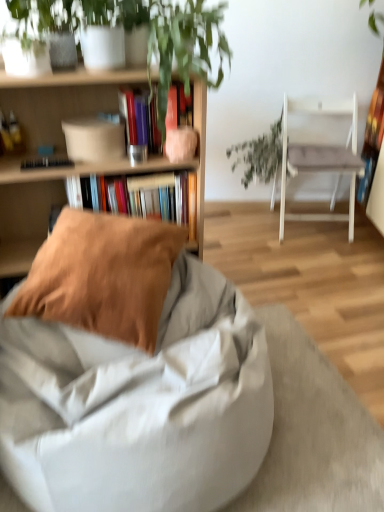
Question: Does hardcover book at center, positioned as the 2th book in bottom-to-top order, come behind light gray fabric bean bag at center, the first chair when ordered from front to back?

Choices:
 (A) no
 (B) yes

Answer: (B)

Question: Considering the relative sizes of hardcover book at center, positioned as the 2th book in bottom-to-top order, and light gray fabric bean bag at center, marked as the 1th chair in a left-to-right arrangement, in the image provided, is hardcover book at center, positioned as the 2th book in bottom-to-top order, taller than light gray fabric bean bag at center, marked as the 1th chair in a left-to-right arrangement,?

Choices:
 (A) yes
 (B) no

Answer: (B)

Question: Considering the relative sizes of hardcover book at center, which is counted as the 1th book, starting from the top, and light gray fabric bean bag at center, which appears as the second chair when viewed from the right, in the image provided, is hardcover book at center, which is counted as the 1th book, starting from the top, thinner than light gray fabric bean bag at center, which appears as the second chair when viewed from the right,?

Choices:
 (A) yes
 (B) no

Answer: (A)

Question: Does hardcover book at center, positioned as the 2th book in bottom-to-top order, have a larger size compared to light gray fabric bean bag at center, the 1th chair positioned from the bottom?

Choices:
 (A) yes
 (B) no

Answer: (B)

Question: Is hardcover book at center, positioned as the 2th book in bottom-to-top order, far from light gray fabric bean bag at center, the second chair positioned from the top?

Choices:
 (A) no
 (B) yes

Answer: (A)

Question: Does hardcover book at center, positioned as the 2th book in bottom-to-top order, turn towards light gray fabric bean bag at center, positioned as the 2th chair in back-to-front order?

Choices:
 (A) yes
 (B) no

Answer: (B)

Question: Is white fabric chair at right, acting as the second chair starting from the bottom, completely or partially outside of hardcover book at center, which is counted as the 1th book, starting from the top?

Choices:
 (A) yes
 (B) no

Answer: (A)

Question: Is white fabric chair at right, the second chair from the front, aimed at hardcover book at center, positioned as the 2th book in bottom-to-top order?

Choices:
 (A) no
 (B) yes

Answer: (A)

Question: Would you say hardcover book at center, which is counted as the 1th book, starting from the top, is part of white fabric chair at right, the second chair from the front,'s contents?

Choices:
 (A) yes
 (B) no

Answer: (B)

Question: Is white fabric chair at right, acting as the first chair starting from the right, oriented away from hardcover book at center, which is counted as the 1th book, starting from the top?

Choices:
 (A) no
 (B) yes

Answer: (A)

Question: Is there a large distance between white fabric chair at right, acting as the second chair starting from the left, and hardcover book at center, which is counted as the 1th book, starting from the top?

Choices:
 (A) yes
 (B) no

Answer: (A)

Question: Is white fabric chair at right, the second chair from the front, with hardcover book at center, positioned as the 2th book in bottom-to-top order?

Choices:
 (A) no
 (B) yes

Answer: (A)

Question: From the image's perspective, is hardcover book at center, positioned as the 2th book in bottom-to-top order, located beneath green leafy plant at center?

Choices:
 (A) no
 (B) yes

Answer: (B)